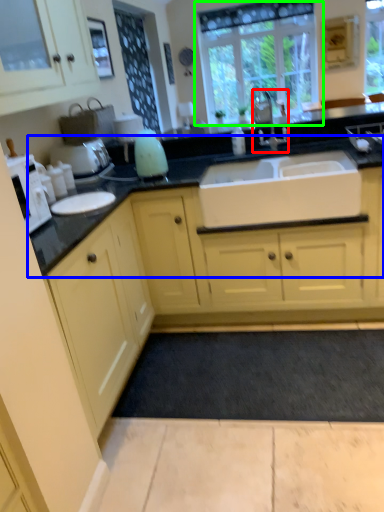
Question: Estimate the real-world distances between objects in this image. Which object is farther from tap (highlighted by a red box), countertop (highlighted by a blue box) or window (highlighted by a green box)?

Choices:
 (A) countertop
 (B) window

Answer: (B)